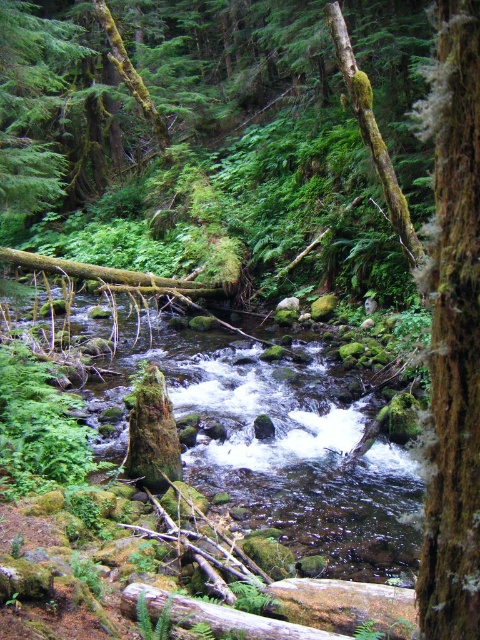
Question: Does clear water at center appear on the right side of brown rough bark tree trunk at right?

Choices:
 (A) yes
 (B) no

Answer: (B)

Question: Which object is closer to the camera taking this photo?

Choices:
 (A) brown rough bark tree trunk at right
 (B) clear water at center

Answer: (A)

Question: Which object appears closest to the camera in this image?

Choices:
 (A) brown rough bark tree trunk at right
 (B) clear water at center

Answer: (A)

Question: Is clear water at center to the right of brown rough bark tree trunk at right from the viewer's perspective?

Choices:
 (A) no
 (B) yes

Answer: (A)

Question: From the image, what is the correct spatial relationship of clear water at center in relation to brown rough bark tree trunk at right?

Choices:
 (A) left
 (B) right

Answer: (A)